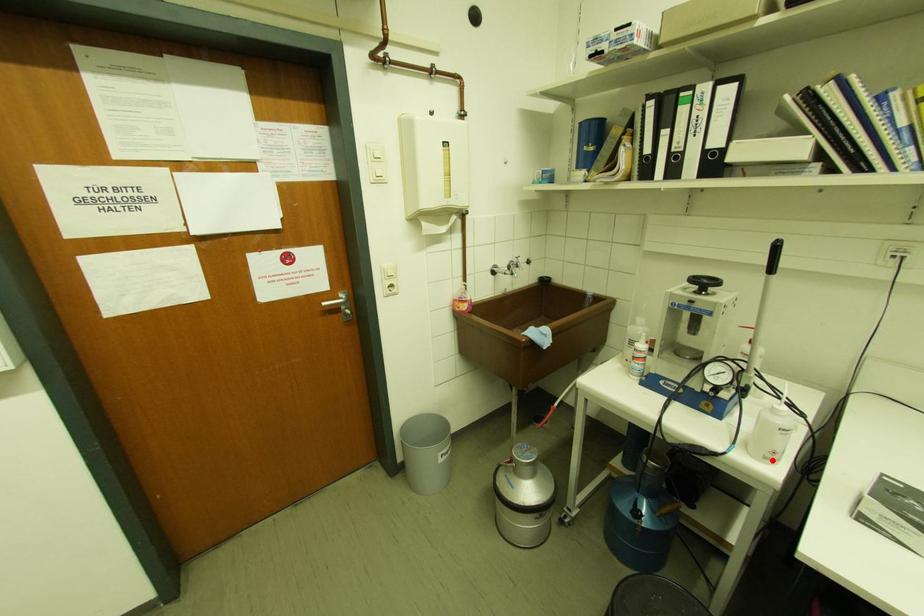
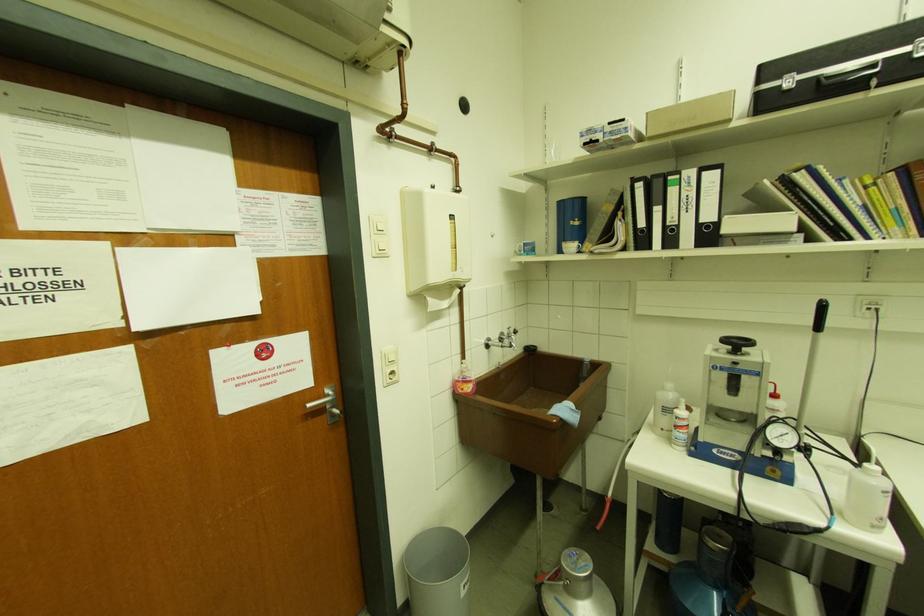
Locate, in the second image, the point that corresponds to the highlighted location in the first image.

(880, 530)